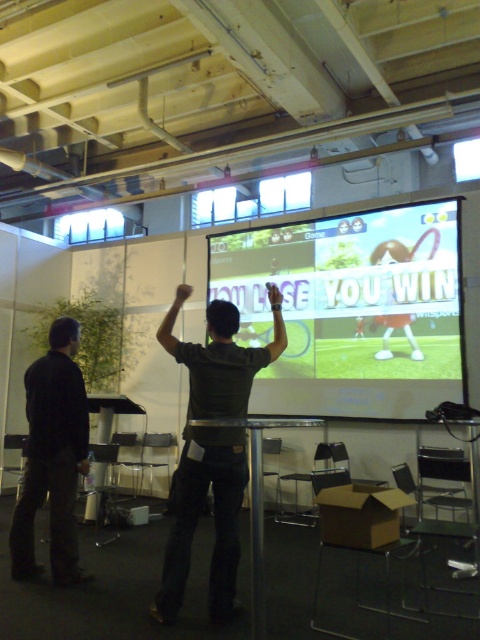
Question: Is matte green screen at center positioned at the back of dark green shirt at center?

Choices:
 (A) yes
 (B) no

Answer: (A)

Question: Does matte green screen at center have a greater width compared to dark green shirt at center?

Choices:
 (A) yes
 (B) no

Answer: (A)

Question: Which point is farther to the camera?

Choices:
 (A) dark gray shirt at left
 (B) dark green shirt at center

Answer: (A)

Question: Estimate the real-world distances between objects in this image. Which object is farther from the dark green shirt at center?

Choices:
 (A) dark gray shirt at left
 (B) matte green screen at center

Answer: (B)

Question: Does matte green screen at center appear over dark gray shirt at left?

Choices:
 (A) no
 (B) yes

Answer: (B)

Question: Estimate the real-world distances between objects in this image. Which object is farther from the matte green screen at center?

Choices:
 (A) dark green shirt at center
 (B) dark gray shirt at left

Answer: (B)